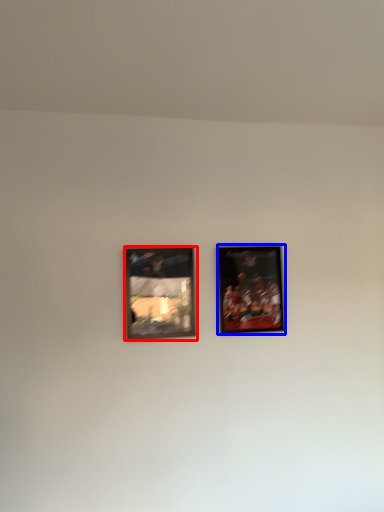
Question: Which object appears closest to the camera in this image, picture frame (highlighted by a red box) or picture frame (highlighted by a blue box)?

Choices:
 (A) picture frame
 (B) picture frame

Answer: (A)